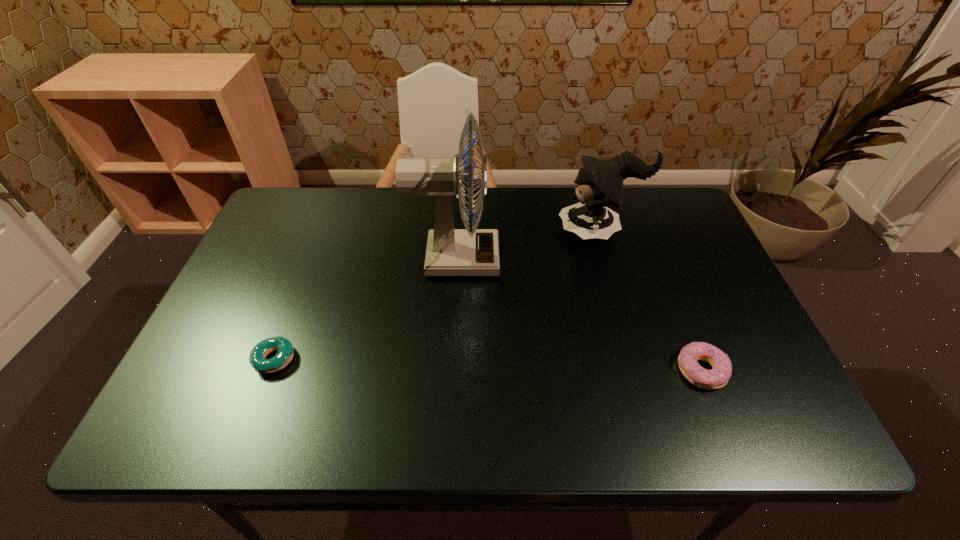
This screenshot has height=540, width=960. I want to click on the tallest object, so pos(450,252).

Locate an element on the screen. The image size is (960, 540). the second object from left to right is located at coordinates (450, 252).

Find the location of a particular element. The width and height of the screenshot is (960, 540). the third shortest object is located at coordinates (600, 182).

The image size is (960, 540). I want to click on the right doughnut, so click(x=716, y=378).

What are the coordinates of `the second shortest object` in the screenshot? It's located at (716, 378).

This screenshot has height=540, width=960. Find the location of `the shortest object`. the shortest object is located at coordinates (285, 353).

This screenshot has width=960, height=540. Find the location of `the shorter doughnut`. the shorter doughnut is located at coordinates (285, 353).

The image size is (960, 540). I want to click on vacant space located 0.110m on the front-facing side of the second object from left to right, so click(539, 259).

Find the location of a particular element. This screenshot has height=540, width=960. blank space located at the face of the second tallest object is located at coordinates (510, 231).

Where is `vacant position located at the face of the second tallest object`? The image size is (960, 540). vacant position located at the face of the second tallest object is located at coordinates (483, 231).